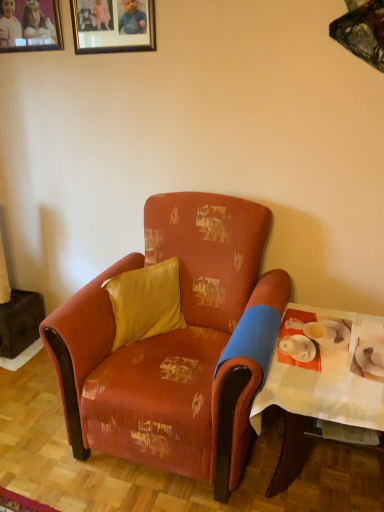
At what (x,y) coordinates should I click in order to perform the action: click on free spot above white paper table at right (from a real-world perspective). Please return your answer as a coordinate pair (x, y). This screenshot has width=384, height=512. Looking at the image, I should click on (327, 352).